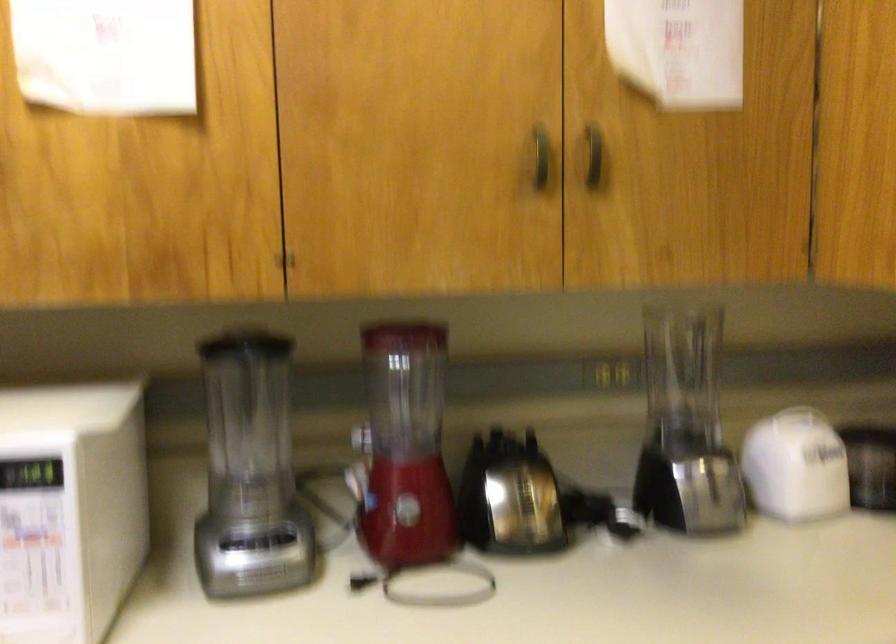
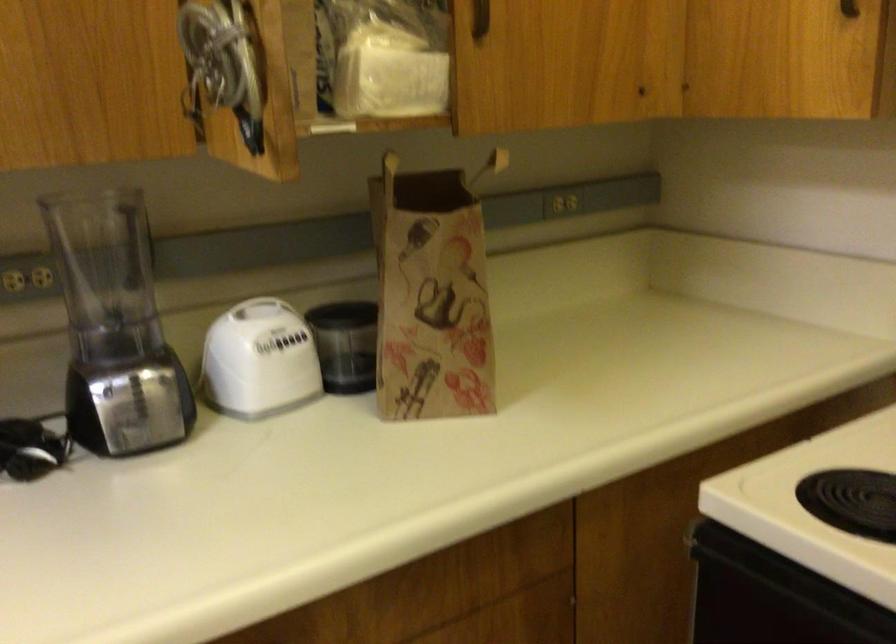
Find the pixel in the second image that matches (x=722, y=482) in the first image.

(149, 395)